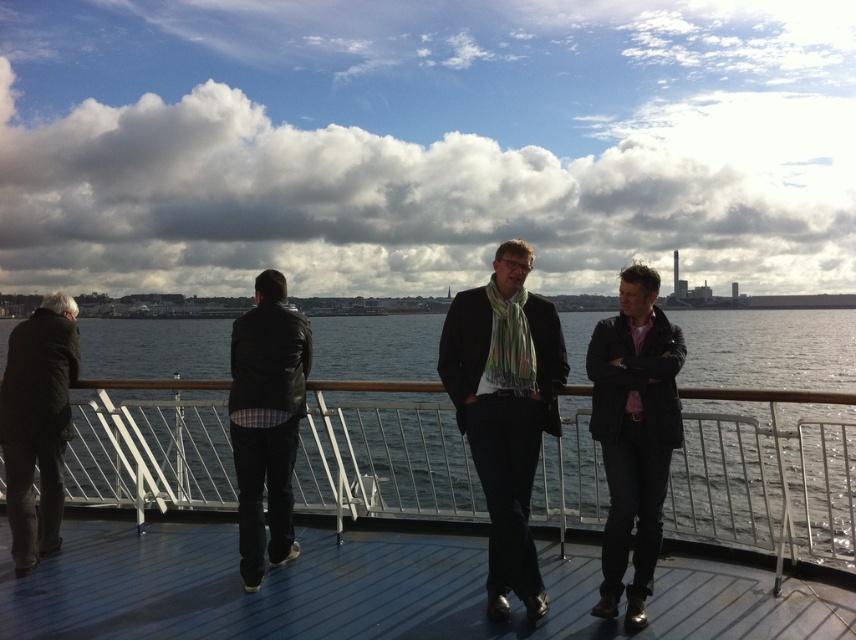
You are standing on the deck and want to walk towards the water. You see two points marked on the railing. Which point, point (853, 506) or point (629, 380), is closer to you as you face the water?

Point (853, 506) is closer to you because it is further to the viewer than point (629, 380).

You are a photographer trying to capture a photo of the blue water at center and the matte black jacket at right. Which object in the scene takes up more space in the photo?

The blue water at center takes up more space in the photo because it is bigger than the matte black jacket at right.

You are standing on the deck and want to move to the matte black jacket at center. Which direction should you move relative to the smooth wooden deck at center?

To reach the matte black jacket at center from the smooth wooden deck at center, you should move to the right since the smooth wooden deck at center is located to the left of the matte black jacket at center.